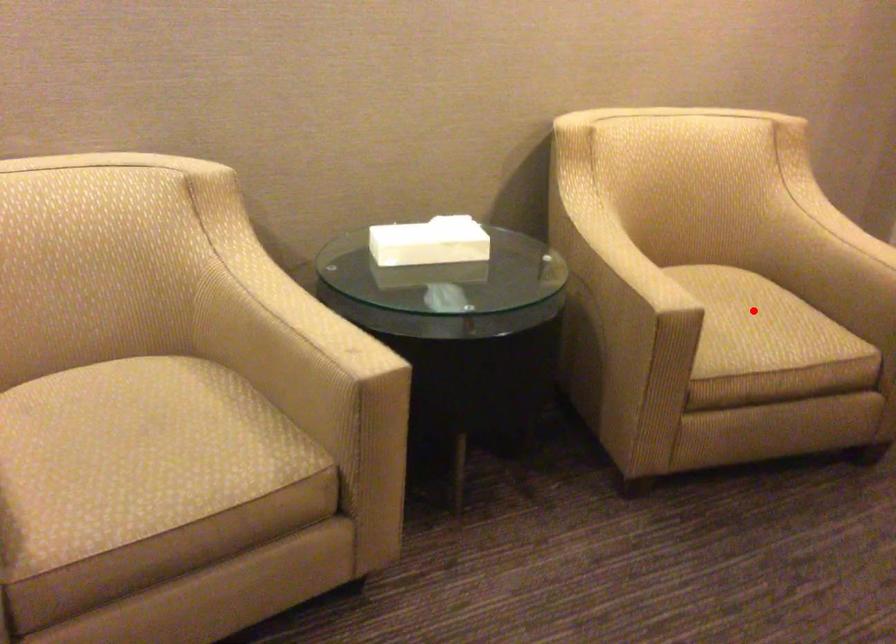
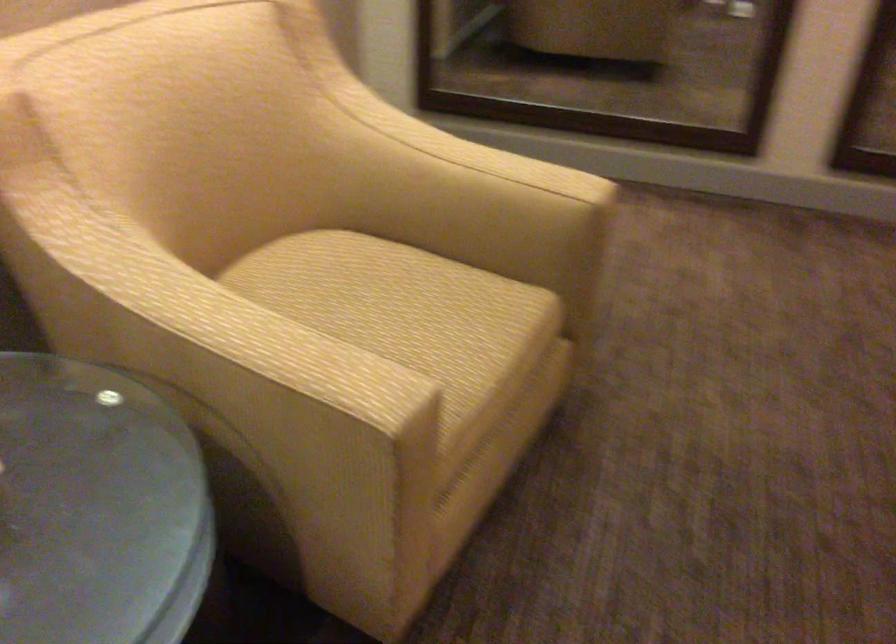
Question: I am providing you with two images of the same scene from different viewpoints. A red point is marked on the first image. At the location where the point appears in image 1, is it still visible in image 2?

Choices:
 (A) Yes
 (B) No

Answer: (A)